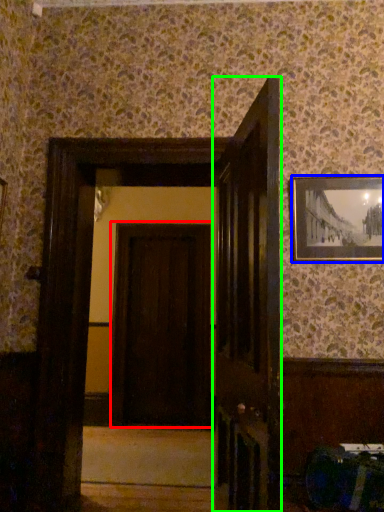
Question: Estimate the real-world distances between objects in this image. Which object is closer to door (highlighted by a red box), picture frame (highlighted by a blue box) or door (highlighted by a green box)?

Choices:
 (A) picture frame
 (B) door

Answer: (A)